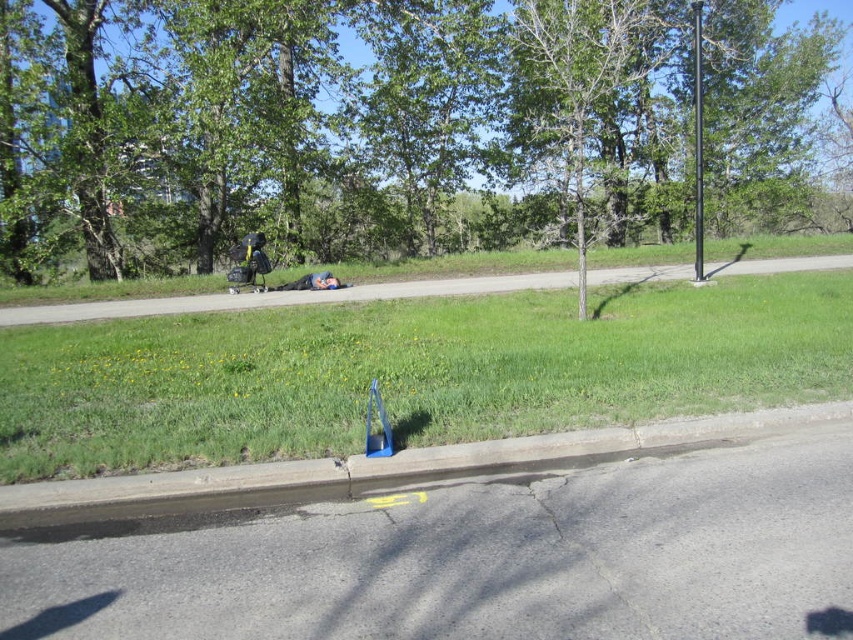
You are a delivery person who needs to place a package on the green grass at lower center. However, there is a blue plastic curb at lower left nearby. According to the scene, which object is located higher up from the ground level?

The green grass at lower center is positioned over the blue plastic curb at lower left, meaning the green grass is higher up from the ground level than the curb.

You are a pedestrian walking along the road and see the green leafy tree at upper center and the blue plastic curb at lower left. Which object is located higher in the image?

The green leafy tree at upper center is positioned over the blue plastic curb at lower left, so it is higher in the image.

You are a pedestrian walking along the pathway and see the green leafy tree at upper center and the black metal pole at center right. Which object is located above the other?

The green leafy tree at upper center is positioned over the black metal pole at center right, so the tree is above the pole.